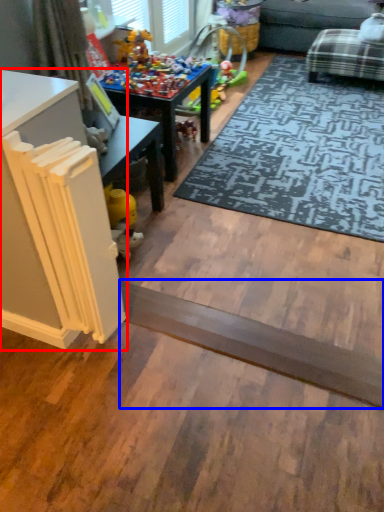
Question: Among these objects, which one is nearest to the camera, table (highlighted by a red box) or plank (highlighted by a blue box)?

Choices:
 (A) table
 (B) plank

Answer: (A)